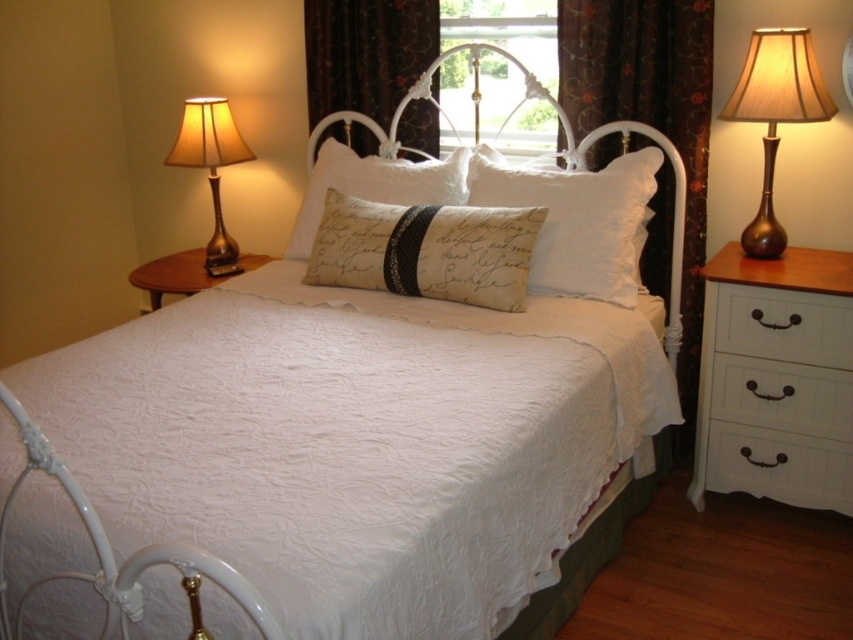
Does white painted wood drawer at lower right appear on the right side of white cotton pillow at center?

Yes, white painted wood drawer at lower right is to the right of white cotton pillow at center.

Does white painted wood drawer at lower right appear under white cotton pillow at center?

Yes, white painted wood drawer at lower right is below white cotton pillow at center.

Does point (776, 435) come farther from viewer compared to point (339, 144)?

No, it is not.

I want to click on white painted wood drawer at lower right, so click(x=778, y=465).

Can you confirm if dark floral fabric curtain at center is positioned to the left of white textured pillow at center?

In fact, dark floral fabric curtain at center is to the right of white textured pillow at center.

Which is more to the right, dark floral fabric curtain at center or white textured pillow at center?

From the viewer's perspective, dark floral fabric curtain at center appears more on the right side.

Is point (706, 80) positioned after point (566, 275)?

Yes.

Where is `dark floral fabric curtain at center`? Image resolution: width=853 pixels, height=640 pixels. dark floral fabric curtain at center is located at coordinates (650, 116).

Which of these two, dark floral fabric curtain at upper center or white cotton pillow at center, stands shorter?

Standing shorter between the two is white cotton pillow at center.

Who is positioned more to the right, dark floral fabric curtain at upper center or white cotton pillow at center?

Positioned to the right is dark floral fabric curtain at upper center.

Who is more forward, [421,48] or [339,189]?

Point [339,189]

Locate an element on the screen. dark floral fabric curtain at upper center is located at coordinates (366, 52).